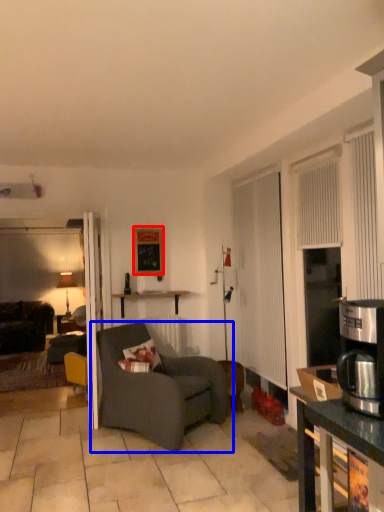
Question: Which of the following is the closest to the observer, picture frame (highlighted by a red box) or chair (highlighted by a blue box)?

Choices:
 (A) picture frame
 (B) chair

Answer: (B)